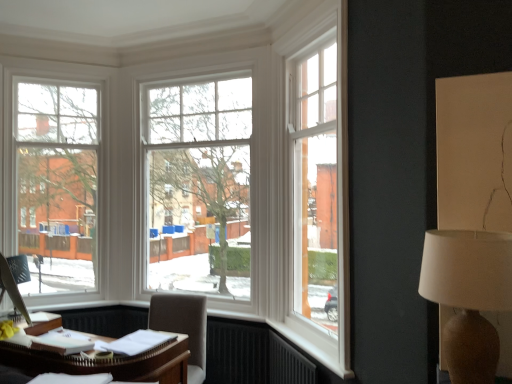
Question: Is light brown fabric chair at lower center surrounding clear glass window at left, which appears as the 1th window when viewed from the left?

Choices:
 (A) no
 (B) yes

Answer: (A)

Question: Does light brown fabric chair at lower center come in front of clear glass window at left, which appears as the 1th window when viewed from the left?

Choices:
 (A) no
 (B) yes

Answer: (B)

Question: Is light brown fabric chair at lower center oriented towards clear glass window at left, which is the 2th window from right to left?

Choices:
 (A) no
 (B) yes

Answer: (A)

Question: Considering the relative positions of light brown fabric chair at lower center and clear glass window at left, which appears as the 1th window when viewed from the left, in the image provided, is light brown fabric chair at lower center to the left of clear glass window at left, which appears as the 1th window when viewed from the left, from the viewer's perspective?

Choices:
 (A) no
 (B) yes

Answer: (A)

Question: Is light brown fabric chair at lower center shorter than clear glass window at left, which appears as the 1th window when viewed from the left?

Choices:
 (A) yes
 (B) no

Answer: (A)

Question: From a real-world perspective, does light brown fabric chair at lower center sit lower than clear glass window at left, which is the 2th window from right to left?

Choices:
 (A) yes
 (B) no

Answer: (A)

Question: From a real-world perspective, is white wooden window at center, which is the 2th window from left to right, physically below white fabric lampshade at right?

Choices:
 (A) no
 (B) yes

Answer: (A)

Question: Could you tell me if white wooden window at center, the first window from the right, is facing white fabric lampshade at right?

Choices:
 (A) no
 (B) yes

Answer: (A)

Question: Considering the relative sizes of white wooden window at center, which is the 2th window from left to right, and white fabric lampshade at right in the image provided, is white wooden window at center, which is the 2th window from left to right, bigger than white fabric lampshade at right?

Choices:
 (A) yes
 (B) no

Answer: (A)

Question: Is white wooden window at center, the first window from the right, outside of white fabric lampshade at right?

Choices:
 (A) no
 (B) yes

Answer: (B)

Question: Does white wooden window at center, the first window from the right, have a lesser height compared to white fabric lampshade at right?

Choices:
 (A) yes
 (B) no

Answer: (B)

Question: Is white wooden window at center, which is the 2th window from left to right, behind white fabric lampshade at right?

Choices:
 (A) no
 (B) yes

Answer: (B)

Question: Is light brown fabric chair at lower center positioned behind white wooden window at center, the first window from the right?

Choices:
 (A) yes
 (B) no

Answer: (B)